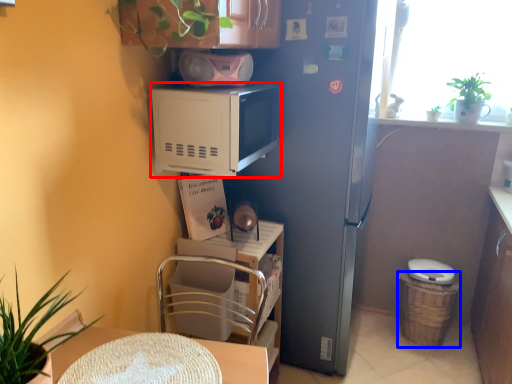
Question: Among these objects, which one is nearest to the camera, microwave oven (highlighted by a red box) or basket (highlighted by a blue box)?

Choices:
 (A) microwave oven
 (B) basket

Answer: (A)